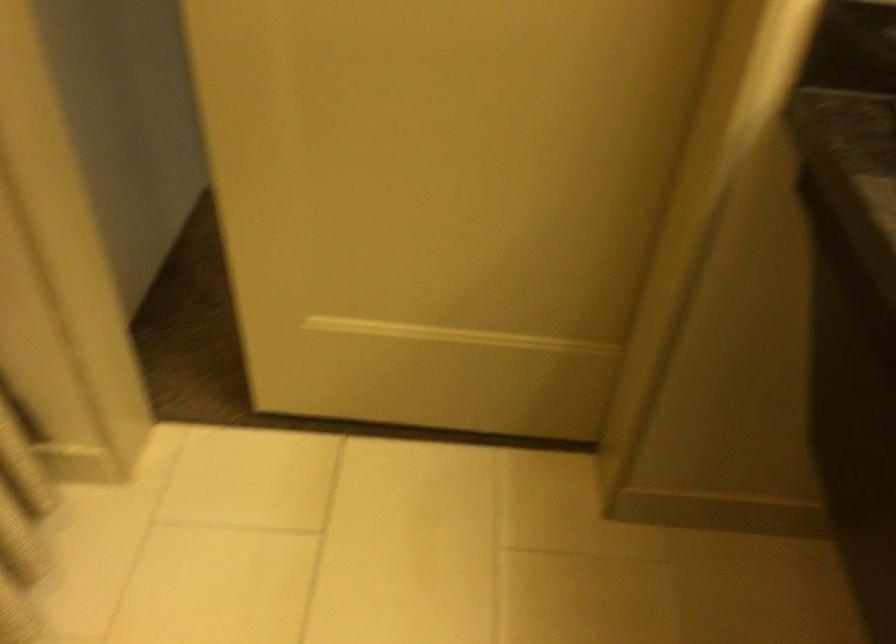
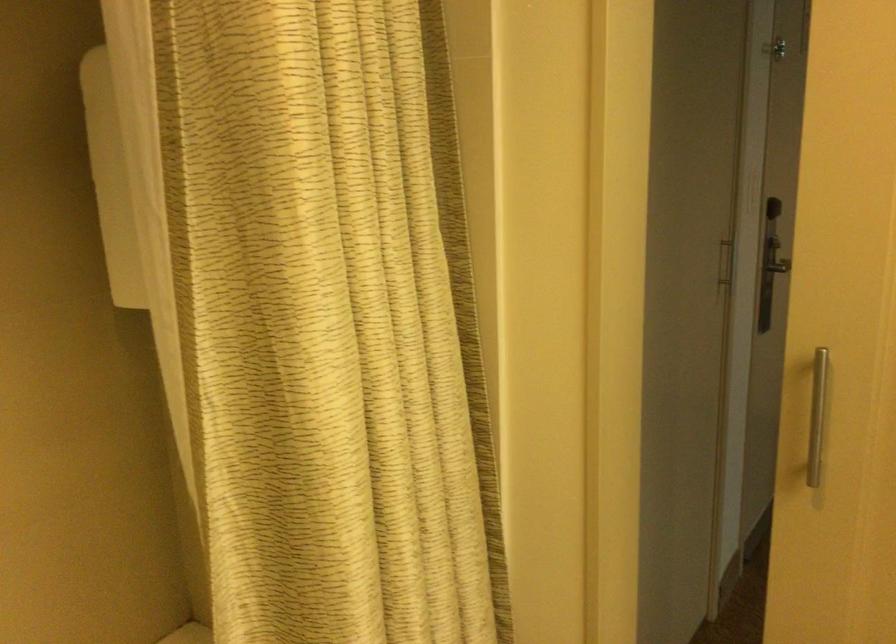
The images are taken continuously from a first-person perspective. In which direction is your viewpoint rotating?

The camera rotated toward left-up.